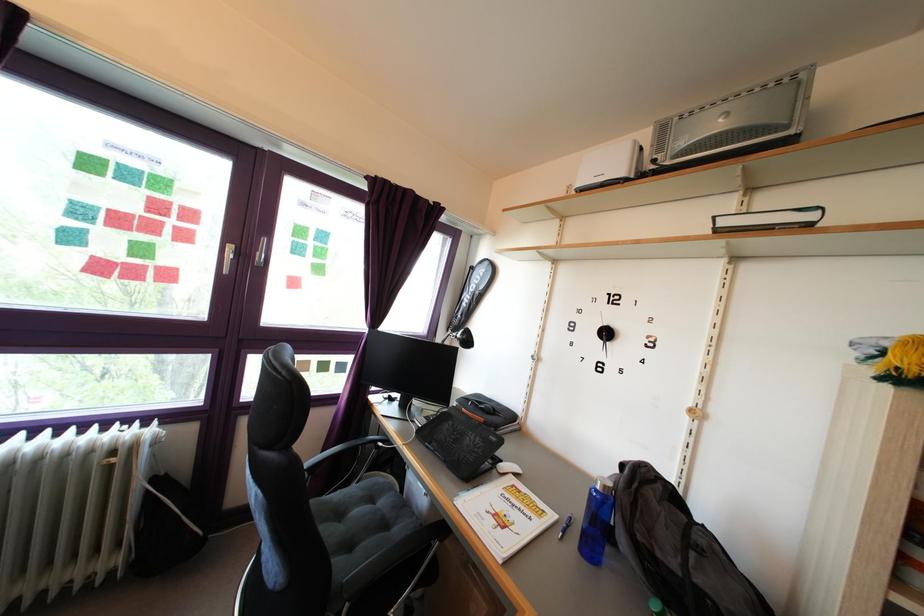
I want to click on black chair armrest, so click(343, 448).